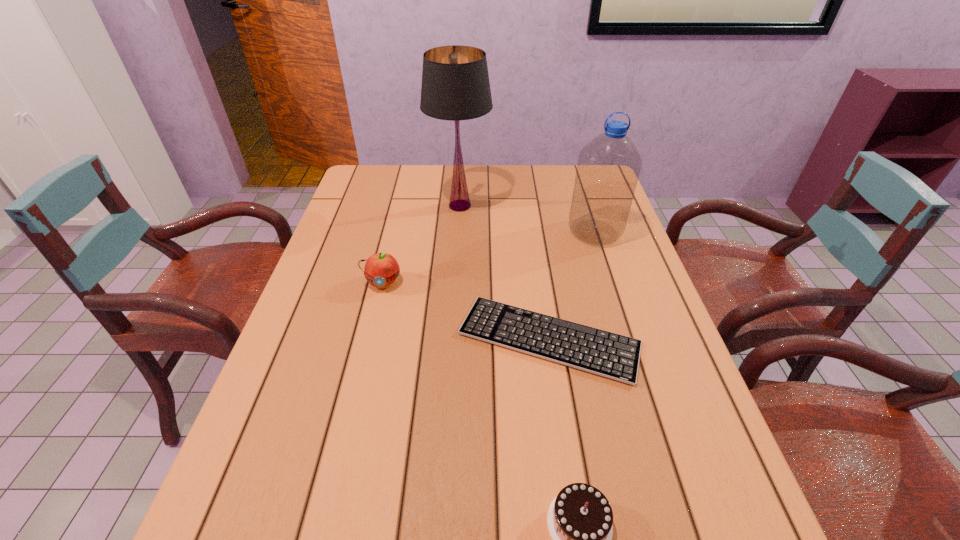
Locate an element on the screen. This screenshot has width=960, height=540. object at the far edge is located at coordinates (455, 86).

The image size is (960, 540). Find the location of `object present at the left edge`. object present at the left edge is located at coordinates (381, 269).

Find the location of `water jug positioned at the right edge`. water jug positioned at the right edge is located at coordinates (608, 168).

What are the coordinates of `computer keyboard present at the right edge` in the screenshot? It's located at (611, 355).

Where is `free space at the far edge of the desktop`? free space at the far edge of the desktop is located at coordinates (473, 183).

Identify the location of free space at the left edge of the desktop. The height and width of the screenshot is (540, 960). (325, 383).

At what (x,y) coordinates should I click in order to perform the action: click on free location at the right edge of the desktop. Please return your answer as a coordinate pair (x, y). Image resolution: width=960 pixels, height=540 pixels. Looking at the image, I should click on (661, 496).

This screenshot has height=540, width=960. Identify the location of vacant area at the far left corner of the desktop. (359, 166).

Identify the location of vacant area between the apple and the water jug. (489, 257).

The height and width of the screenshot is (540, 960). In order to click on unoccupied position between the water jug and the tallest object in this screenshot , I will do `click(527, 219)`.